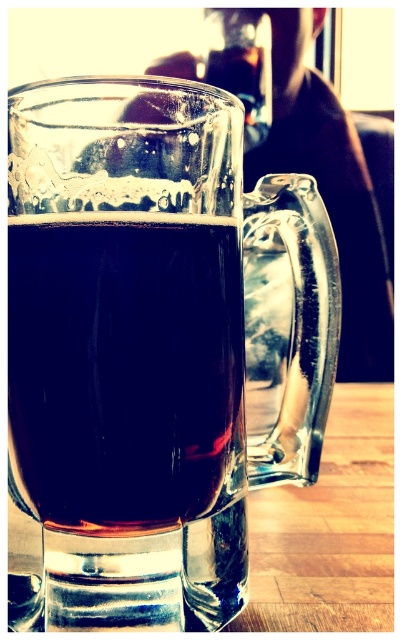
Which is below, transparent glass mug at center or transparent glass wine at center?

Positioned lower is transparent glass mug at center.

Between transparent glass mug at center and transparent glass wine at center, which one appears on the left side from the viewer's perspective?

From the viewer's perspective, transparent glass wine at center appears more on the left side.

You are a GUI agent. You are given a task and a screenshot of the screen. Output one action in this format:
    pyautogui.click(x=<x>, y=<y>)
    Task: Click on the transparent glass mug at center
    
    Given the screenshot: What is the action you would take?
    pyautogui.click(x=155, y=346)